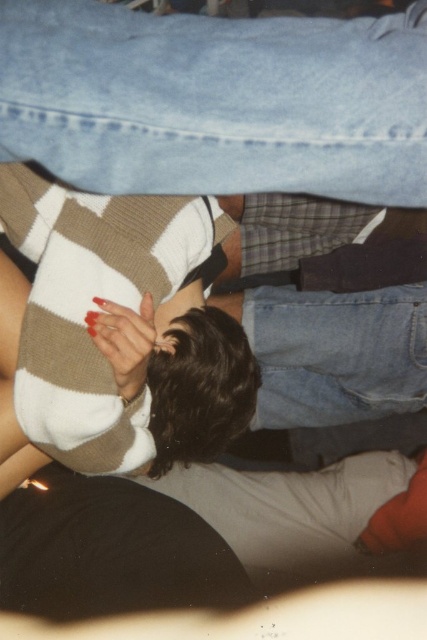
You are a photographer trying to capture a candid shot of the denim jeans at upper center and the shiny red nails at center. Since you want to ensure both subjects are in focus, you need to know their relative sizes. Which object is taller?

The denim jeans at upper center is taller than the shiny red nails at center.

You are a photographer standing at the camera position. You want to ensure that the denim jeans at upper center are in focus while capturing the scene. Based on the given information, what is the minimum distance you should set your camera lens to achieve this?

The denim jeans at upper center is 17.96 inches away from the camera. To ensure it is in focus, the camera lens should be set to a minimum focusing distance of at least 17.96 inches.

You are a photographer taking a picture from above. You see the denim jeans at upper center and the shiny red nails at center. Which object is positioned higher in the image?

The denim jeans at upper center is positioned higher than the shiny red nails at center.